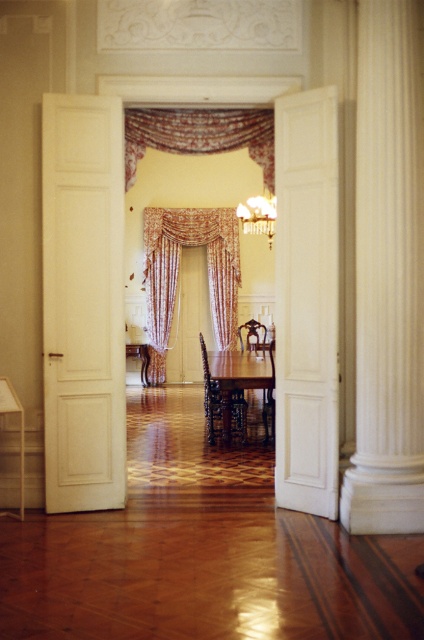
What do you see at coordinates (387, 275) in the screenshot?
I see `white marble column at center` at bounding box center [387, 275].

In order to click on white marble column at center in this screenshot , I will do `click(387, 275)`.

This screenshot has height=640, width=424. I want to click on patterned fabric curtain at center, so click(200, 134).

Which is behind, point (136, 132) or point (262, 224)?

Positioned behind is point (262, 224).

You are a GUI agent. You are given a task and a screenshot of the screen. Output one action in this format:
    pyautogui.click(x=<x>, y=<y>)
    Task: Click on the patterned fabric curtain at center
    This screenshot has width=424, height=640.
    Given the screenshot: What is the action you would take?
    pyautogui.click(x=200, y=134)

Which of these two, white marble column at center or gold metallic chandelier at center, stands shorter?

With less height is gold metallic chandelier at center.

This screenshot has height=640, width=424. Find the location of `white marble column at center`. white marble column at center is located at coordinates (387, 275).

The width and height of the screenshot is (424, 640). I want to click on white marble column at center, so click(387, 275).